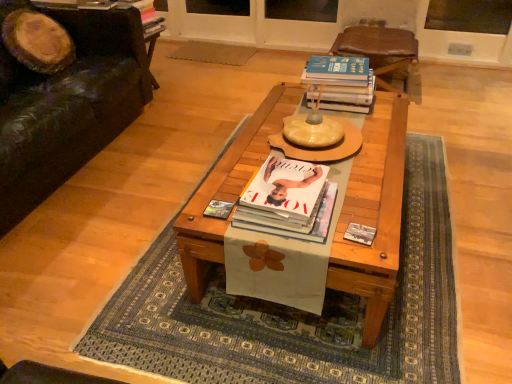
At what (x,y) coordinates should I click in order to perform the action: click on vacant area situated to the left side of hardcover book at upper right, the second book from the bottom. Please return your answer as a coordinate pair (x, y). This screenshot has width=512, height=384. Looking at the image, I should click on (277, 110).